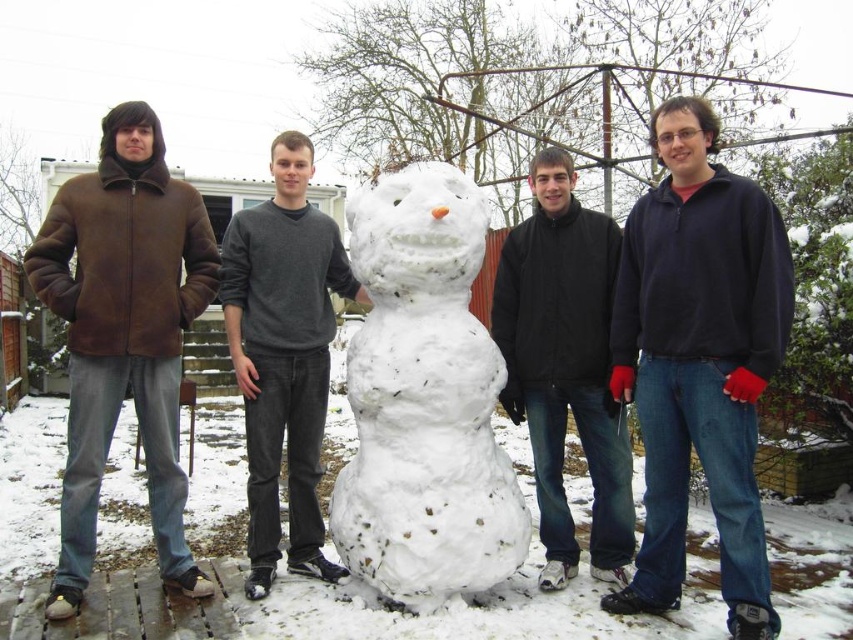
Does dark blue fleece at right have a greater height compared to brown suede jacket at left?

In fact, dark blue fleece at right may be shorter than brown suede jacket at left.

Between point (683, 259) and point (45, 236), which one is positioned behind?

Positioned behind is point (45, 236).

The width and height of the screenshot is (853, 640). Find the location of `dark blue fleece at right`. dark blue fleece at right is located at coordinates click(x=699, y=360).

Can you confirm if dark blue fleece at right is taller than white fluffy snowman at center?

Indeed, dark blue fleece at right has a greater height compared to white fluffy snowman at center.

Based on the photo, does dark blue fleece at right come behind white fluffy snowman at center?

No, dark blue fleece at right is closer to the viewer.

Is point (709, 337) behind point (471, 346)?

No, it is in front of (471, 346).

I want to click on dark blue fleece at right, so click(699, 360).

Is black matte jacket at center positioned before dark gray sweater at center?

No, black matte jacket at center is further to the viewer.

Is point (596, 452) positioned in front of point (228, 333)?

No.

At what (x,y) coordinates should I click in order to perform the action: click on black matte jacket at center. Please return your answer as a coordinate pair (x, y). This screenshot has width=853, height=640. Looking at the image, I should click on (566, 365).